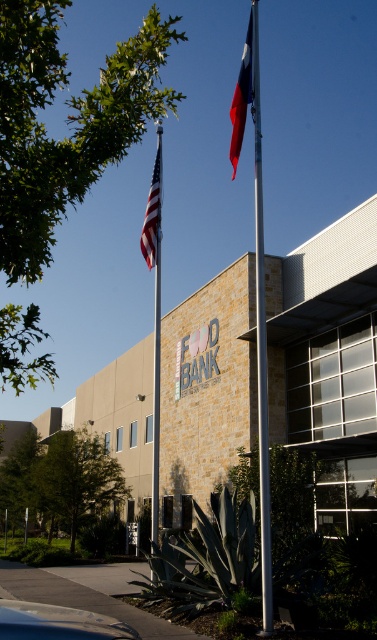
Who is higher up, silver metallic flag pole at center or american flag at upper left?

Positioned higher is silver metallic flag pole at center.

Does silver metallic flag pole at center have a greater height compared to american flag at upper left?

Correct, silver metallic flag pole at center is much taller as american flag at upper left.

At what (x,y) coordinates should I click in order to perform the action: click on silver metallic flag pole at center. Please return your answer as a coordinate pair (x, y). The height and width of the screenshot is (640, 377). Looking at the image, I should click on (260, 342).

Find the location of a particular element. silver metallic flag pole at center is located at coordinates (260, 342).

Locate an element on the screen. The height and width of the screenshot is (640, 377). silver metallic flag pole at center is located at coordinates coord(260,342).

Find the location of a particular element. The width and height of the screenshot is (377, 640). silver metallic flag pole at center is located at coordinates (260, 342).

Consider the image. Can you confirm if metallic silver car at lower left is positioned below american flag at upper left?

Correct, metallic silver car at lower left is located below american flag at upper left.

Does point (116, 620) come behind point (151, 250)?

No, (116, 620) is in front of (151, 250).

Locate an element on the screen. metallic silver car at lower left is located at coordinates (58, 621).